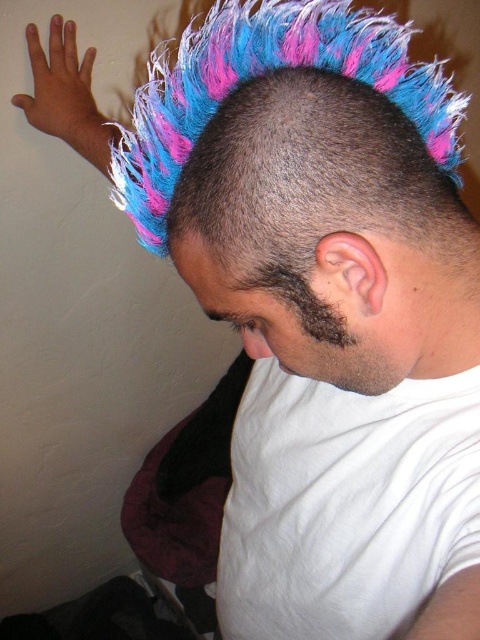
Question: Is shiny multicolored mohawk at center to the left of dark brown fuzzy beard at lower right from the viewer's perspective?

Choices:
 (A) no
 (B) yes

Answer: (A)

Question: Which object appears closest to the camera in this image?

Choices:
 (A) shiny multicolored mohawk at center
 (B) dark brown fuzzy beard at lower right

Answer: (A)

Question: Does shiny multicolored mohawk at center appear under dark brown fuzzy beard at lower right?

Choices:
 (A) no
 (B) yes

Answer: (A)

Question: Which point is closer to the camera taking this photo?

Choices:
 (A) (287, 108)
 (B) (363, 368)

Answer: (A)

Question: Among these points, which one is nearest to the camera?

Choices:
 (A) (268, 289)
 (B) (360, 218)

Answer: (B)

Question: Is shiny multicolored mohawk at center positioned in front of dark brown fuzzy beard at lower right?

Choices:
 (A) yes
 (B) no

Answer: (A)